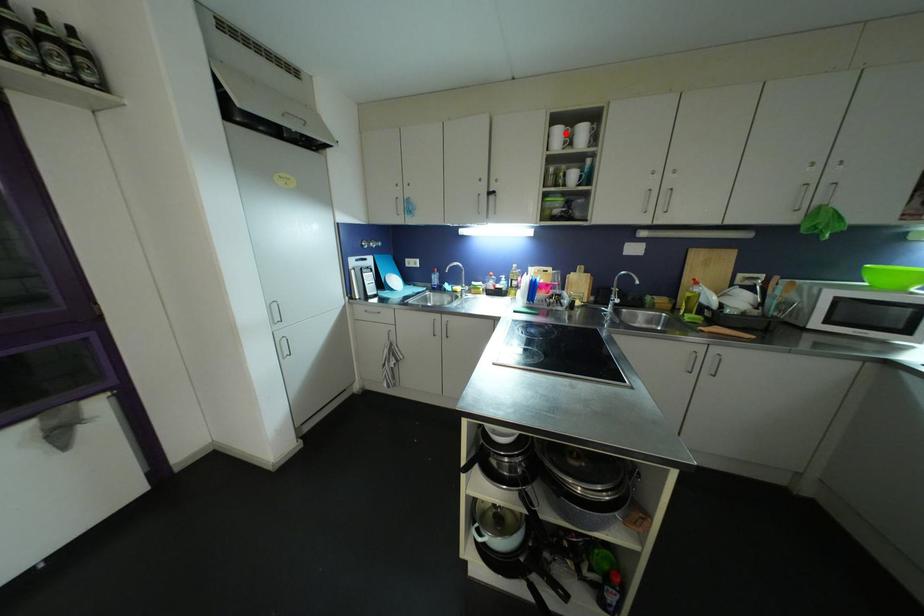
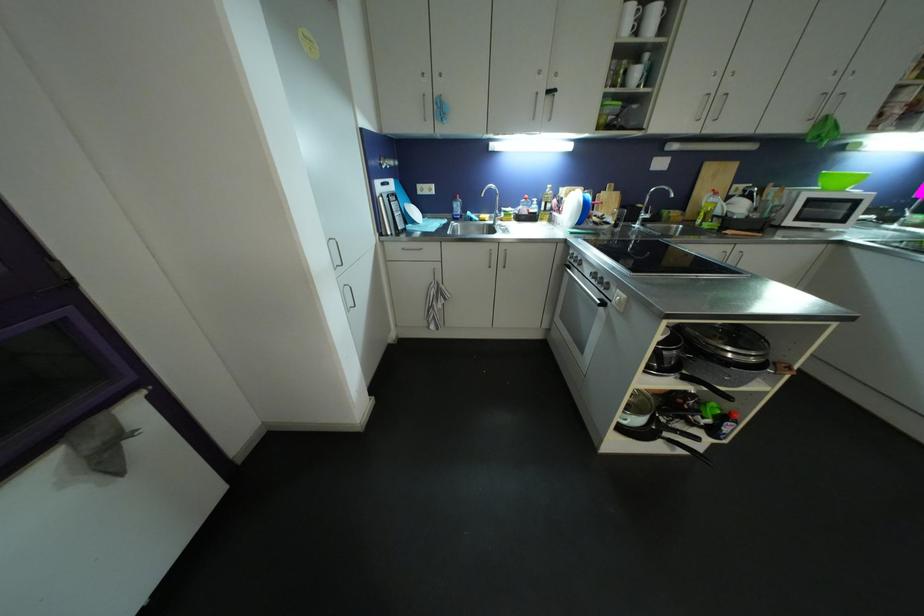
Locate, in the second image, the point that corresponds to the highlighted location in the first image.

(638, 13)